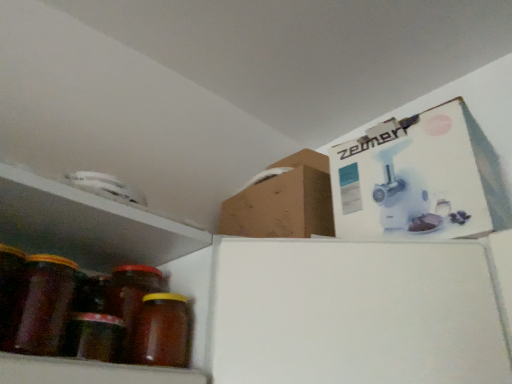
Question: From a real-world perspective, is brown matte jar at left, marked as the 1th bottle in a left-to-right arrangement, positioned above or below translucent amber glass jar at lower left?

Choices:
 (A) above
 (B) below

Answer: (A)

Question: Is brown matte jar at left, which is counted as the second bottle, starting from the right, wider or thinner than translucent amber glass jar at lower left?

Choices:
 (A) wide
 (B) thin

Answer: (B)

Question: Which of these objects is positioned farthest from the brown matte jar at left, marked as the 1th bottle in a left-to-right arrangement?

Choices:
 (A) translucent amber glass jar at lower left
 (B) brown matte jar at lower left, the 2th bottle in the left-to-right sequence

Answer: (B)

Question: Estimate the real-world distances between objects in this image. Which object is closer to the brown matte jar at left, marked as the 1th bottle in a left-to-right arrangement?

Choices:
 (A) translucent amber glass jar at lower left
 (B) brown matte jar at lower left, the first bottle from the right

Answer: (A)